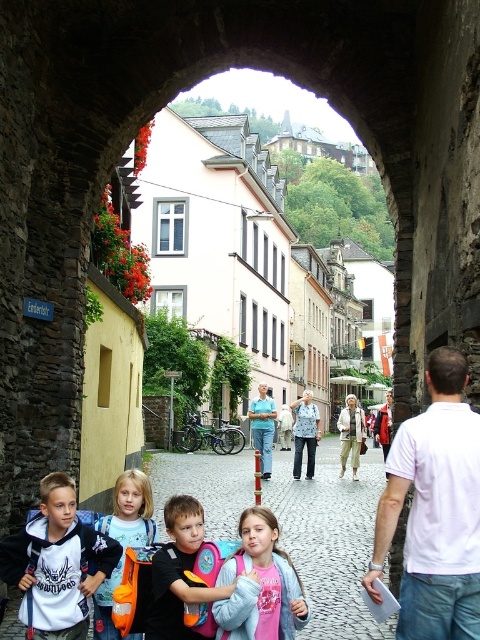
Question: Among these objects, which one is farthest from the camera?

Choices:
 (A) denim jacket at center
 (B) light beige fabric coat at center
 (C) light blue shirt at center

Answer: (B)

Question: Which object is farther from the camera taking this photo?

Choices:
 (A) denim jacket at center
 (B) light beige fabric coat at center

Answer: (B)

Question: Among these objects, which one is nearest to the camera?

Choices:
 (A) pink fabric backpack at center
 (B) light beige fabric coat at center
 (C) denim jacket at center

Answer: (A)

Question: Is denim jacket at center smaller than light blue shirt at center?

Choices:
 (A) no
 (B) yes

Answer: (A)

Question: Does light blue denim jacket at lower center lie behind light beige fabric coat at center?

Choices:
 (A) no
 (B) yes

Answer: (A)

Question: Does white cotton hoodie at lower left appear under light beige fabric coat at center?

Choices:
 (A) yes
 (B) no

Answer: (B)